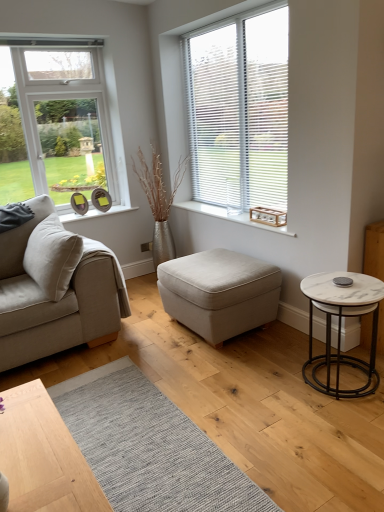
Question: Is beige fabric couch at left bigger than white marble side table at right?

Choices:
 (A) yes
 (B) no

Answer: (A)

Question: Considering the relative sizes of beige fabric couch at left and white marble side table at right in the image provided, is beige fabric couch at left wider than white marble side table at right?

Choices:
 (A) no
 (B) yes

Answer: (B)

Question: Is beige fabric couch at left positioned before white marble side table at right?

Choices:
 (A) no
 (B) yes

Answer: (A)

Question: From a real-world perspective, is beige fabric couch at left beneath white marble side table at right?

Choices:
 (A) yes
 (B) no

Answer: (B)

Question: Is beige fabric couch at left next to white marble side table at right?

Choices:
 (A) yes
 (B) no

Answer: (B)

Question: Is beige fabric couch at left completely or partially outside of white marble side table at right?

Choices:
 (A) no
 (B) yes

Answer: (B)

Question: Is white marble side table at right bigger than beige fabric couch at left?

Choices:
 (A) yes
 (B) no

Answer: (B)

Question: From a real-world perspective, is white marble side table at right over beige fabric couch at left?

Choices:
 (A) no
 (B) yes

Answer: (A)

Question: Does white marble side table at right have a greater height compared to beige fabric couch at left?

Choices:
 (A) yes
 (B) no

Answer: (B)

Question: Is white marble side table at right oriented away from beige fabric couch at left?

Choices:
 (A) yes
 (B) no

Answer: (B)

Question: Is white marble side table at right positioned in front of beige fabric couch at left?

Choices:
 (A) yes
 (B) no

Answer: (A)

Question: From the image's perspective, is white marble side table at right above beige fabric couch at left?

Choices:
 (A) yes
 (B) no

Answer: (B)

Question: Does white marble side table at right have a greater height compared to white blinds at upper right?

Choices:
 (A) no
 (B) yes

Answer: (A)